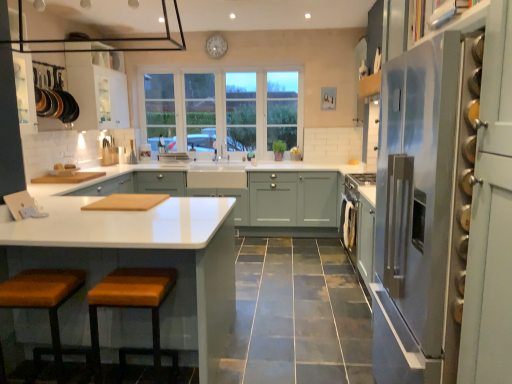
Question: Is satin silver refrigerator at right beside white glossy drawer at center?

Choices:
 (A) no
 (B) yes

Answer: (A)

Question: From the image's perspective, is satin silver refrigerator at right under white glossy drawer at center?

Choices:
 (A) no
 (B) yes

Answer: (B)

Question: Can you confirm if satin silver refrigerator at right is positioned to the left of white glossy drawer at center?

Choices:
 (A) no
 (B) yes

Answer: (A)

Question: From a real-world perspective, is satin silver refrigerator at right positioned over white glossy drawer at center based on gravity?

Choices:
 (A) yes
 (B) no

Answer: (A)

Question: Is satin silver refrigerator at right far away from white glossy drawer at center?

Choices:
 (A) yes
 (B) no

Answer: (A)

Question: Do you think white glossy drawer at center is within white plastic clock at upper center, or outside of it?

Choices:
 (A) inside
 (B) outside

Answer: (B)

Question: Considering the relative positions of white glossy drawer at center and white plastic clock at upper center in the image provided, is white glossy drawer at center to the left or to the right of white plastic clock at upper center?

Choices:
 (A) right
 (B) left

Answer: (A)

Question: In terms of height, does white glossy drawer at center look taller or shorter compared to white plastic clock at upper center?

Choices:
 (A) short
 (B) tall

Answer: (A)

Question: Is white glossy drawer at center wider or thinner than white plastic clock at upper center?

Choices:
 (A) wide
 (B) thin

Answer: (A)

Question: From the image's perspective, relative to orange leather stool at lower left, the 2th stool in the left-to-right sequence, is white glossy drawer at center above or below?

Choices:
 (A) below
 (B) above

Answer: (B)

Question: In terms of height, does white glossy drawer at center look taller or shorter compared to orange leather stool at lower left, the first stool from the right?

Choices:
 (A) tall
 (B) short

Answer: (B)

Question: Is white glossy drawer at center in front of or behind orange leather stool at lower left, the first stool from the right, in the image?

Choices:
 (A) front
 (B) behind

Answer: (B)

Question: Considering the positions of point (188, 175) and point (152, 314), is point (188, 175) closer or farther from the camera than point (152, 314)?

Choices:
 (A) closer
 (B) farther

Answer: (B)

Question: From a real-world perspective, is black glass exhaust hood at upper center positioned above or below white wood window at center?

Choices:
 (A) below
 (B) above

Answer: (B)

Question: Is black glass exhaust hood at upper center spatially inside white wood window at center, or outside of it?

Choices:
 (A) outside
 (B) inside

Answer: (A)